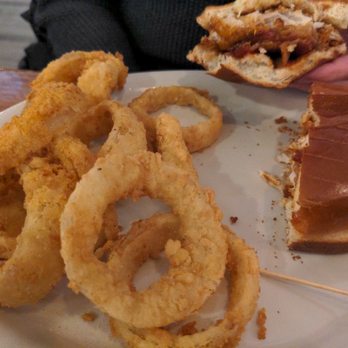
Identify the location of tabletop. This screenshot has width=348, height=348. (9, 88).